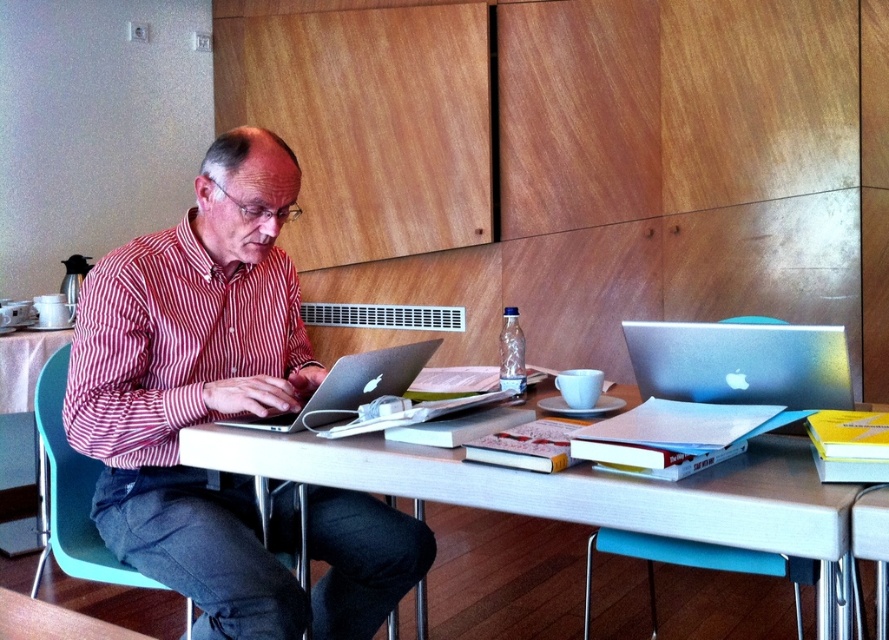
You are organizing a small event and need to place a rectangular centerpiece on the table. The centerpiece is as wide as the silver metallic laptop at center. Will it fit entirely on the white matte table at center without overhanging the edges?

The white matte table at center is wider than the silver metallic laptop at center, so the centerpiece, being the same width as the laptop, will fit entirely on the table without overhanging the edges.

You are helping organize a clothing store and notice two red striped shirts displayed on mannequins. The red striped shirt at center and the red striped shirt at left are both available. A customer asks which one is bigger. How do you respond?

The red striped shirt at center is wider than the red striped shirt at left, so the red striped shirt at center is the larger one.